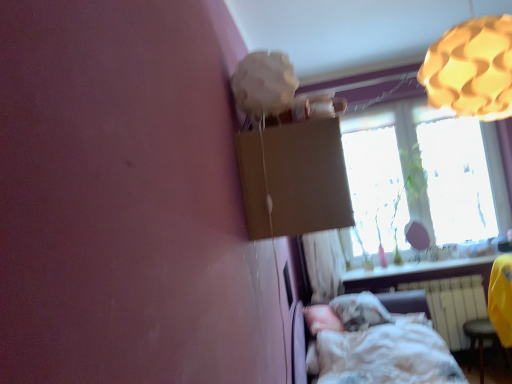
Question: In terms of width, does white paper lampshade at upper center, placed as the 1th lamp when sorted from left to right, look wider or thinner when compared to white matte radiator at lower right?

Choices:
 (A) thin
 (B) wide

Answer: (B)

Question: Is white paper lampshade at upper center, which ranks as the 2th lamp in right-to-left order, in front of or behind white matte radiator at lower right in the image?

Choices:
 (A) front
 (B) behind

Answer: (A)

Question: Considering the real-world distances, which object is farthest from the white paper lampshade at upper center, which ranks as the 2th lamp in right-to-left order?

Choices:
 (A) yellow fabric swivel chair at lower right
 (B) yellow plastic stool at lower right
 (C) brown cardboard box at upper center
 (D) white cotton bed at lower right
 (E) translucent glass window at upper right

Answer: (B)

Question: Which object is the farthest from the white matte radiator at lower right?

Choices:
 (A) white paper lampshade at upper center, which ranks as the 2th lamp in right-to-left order
 (B) brown cardboard box at upper center
 (C) smooth white window sill at lower right
 (D) translucent glass window at upper right
 (E) yellow fabric swivel chair at lower right

Answer: (A)